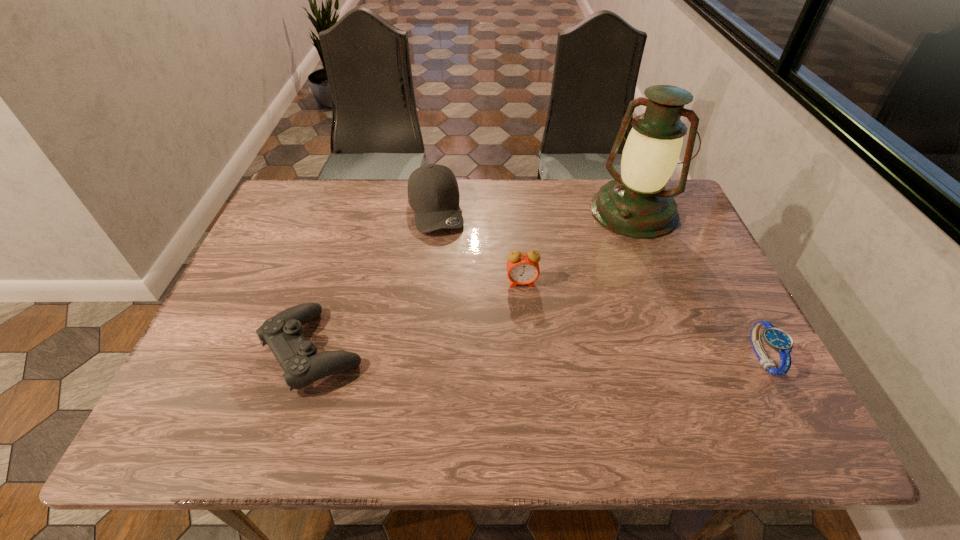
Where is `watch located in the near edge section of the desktop`? The height and width of the screenshot is (540, 960). watch located in the near edge section of the desktop is located at coordinates (777, 339).

This screenshot has height=540, width=960. I want to click on object at the left edge, so click(297, 356).

Locate an element on the screen. Image resolution: width=960 pixels, height=540 pixels. watch that is positioned at the right edge is located at coordinates (777, 339).

Where is `lantern located at the right edge`? Image resolution: width=960 pixels, height=540 pixels. lantern located at the right edge is located at coordinates (635, 204).

Find the location of a particular element. This screenshot has height=540, width=960. object located at the near left corner is located at coordinates (297, 356).

You are a GUI agent. You are given a task and a screenshot of the screen. Output one action in this format:
    pyautogui.click(x=<x>, y=<y>)
    Task: Click on the object that is at the far right corner
    The width and height of the screenshot is (960, 540).
    Given the screenshot: What is the action you would take?
    pyautogui.click(x=635, y=204)

Locate an element on the screen. object that is at the near right corner is located at coordinates (777, 339).

Identify the location of blank space at the far edge of the desktop. pyautogui.click(x=471, y=202).

Find the location of a particular element. The height and width of the screenshot is (540, 960). free spot at the near edge of the desktop is located at coordinates (442, 374).

At what (x,y) coordinates should I click in order to perform the action: click on free space at the left edge. Please return your answer as a coordinate pair (x, y). Image resolution: width=960 pixels, height=540 pixels. Looking at the image, I should click on (251, 273).